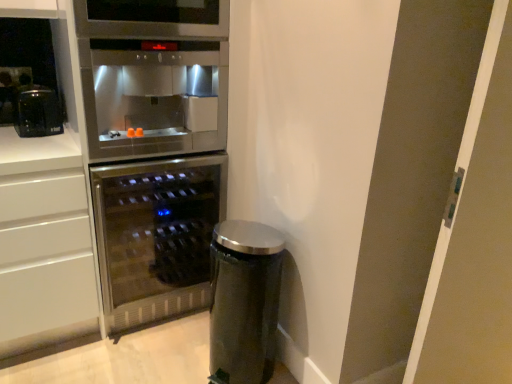
Question: Considering the relative sizes of transparent glass door at right and stainless steel oven at upper center in the image provided, is transparent glass door at right thinner than stainless steel oven at upper center?

Choices:
 (A) no
 (B) yes

Answer: (B)

Question: Is transparent glass door at right to the right of stainless steel oven at upper center from the viewer's perspective?

Choices:
 (A) yes
 (B) no

Answer: (A)

Question: Is the depth of transparent glass door at right greater than that of stainless steel oven at upper center?

Choices:
 (A) no
 (B) yes

Answer: (A)

Question: Is transparent glass door at right positioned with its back to stainless steel oven at upper center?

Choices:
 (A) yes
 (B) no

Answer: (B)

Question: Is transparent glass door at right to the left of stainless steel oven at upper center from the viewer's perspective?

Choices:
 (A) no
 (B) yes

Answer: (A)

Question: From the image's perspective, is transparent glass door at right above stainless steel oven at upper center?

Choices:
 (A) no
 (B) yes

Answer: (A)

Question: Is stainless steel wine cooler at center oriented towards transparent glass door at right?

Choices:
 (A) no
 (B) yes

Answer: (A)

Question: Does stainless steel wine cooler at center come in front of transparent glass door at right?

Choices:
 (A) no
 (B) yes

Answer: (A)

Question: Does stainless steel wine cooler at center appear on the right side of transparent glass door at right?

Choices:
 (A) yes
 (B) no

Answer: (B)

Question: Considering the relative sizes of stainless steel wine cooler at center and transparent glass door at right in the image provided, is stainless steel wine cooler at center thinner than transparent glass door at right?

Choices:
 (A) yes
 (B) no

Answer: (B)

Question: From a real-world perspective, is stainless steel wine cooler at center on top of transparent glass door at right?

Choices:
 (A) yes
 (B) no

Answer: (B)

Question: Does stainless steel wine cooler at center have a lesser height compared to transparent glass door at right?

Choices:
 (A) yes
 (B) no

Answer: (A)

Question: Can you confirm if satin silver trash can at lower right is wider than stainless steel wine cooler at center?

Choices:
 (A) yes
 (B) no

Answer: (B)